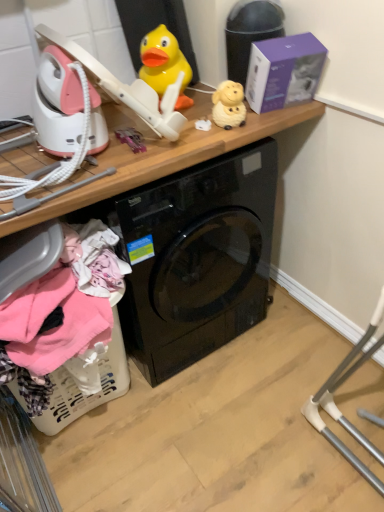
Question: From a real-world perspective, is wooden at upper center physically below white plastic laundry basket at lower left?

Choices:
 (A) no
 (B) yes

Answer: (A)

Question: Considering the relative sizes of wooden at upper center and white plastic laundry basket at lower left in the image provided, is wooden at upper center shorter than white plastic laundry basket at lower left?

Choices:
 (A) yes
 (B) no

Answer: (B)

Question: Is white plastic laundry basket at lower left completely or partially inside wooden at upper center?

Choices:
 (A) no
 (B) yes

Answer: (B)

Question: From the image's perspective, is wooden at upper center over white plastic laundry basket at lower left?

Choices:
 (A) yes
 (B) no

Answer: (A)

Question: Is wooden at upper center at the right side of white plastic laundry basket at lower left?

Choices:
 (A) no
 (B) yes

Answer: (B)

Question: Does wooden at upper center have a smaller size compared to white plastic laundry basket at lower left?

Choices:
 (A) no
 (B) yes

Answer: (A)

Question: Is white plastic laundry basket at lower left closer to camera compared to matte yellow sheep at upper center, placed as the 2th toy when sorted from left to right?

Choices:
 (A) no
 (B) yes

Answer: (B)

Question: Does white plastic laundry basket at lower left contain matte yellow sheep at upper center, placed as the 2th toy when sorted from left to right?

Choices:
 (A) yes
 (B) no

Answer: (B)

Question: Is white plastic laundry basket at lower left to the left of matte yellow sheep at upper center, positioned as the first toy in right-to-left order, from the viewer's perspective?

Choices:
 (A) no
 (B) yes

Answer: (B)

Question: Is white plastic laundry basket at lower left aimed at matte yellow sheep at upper center, positioned as the first toy in right-to-left order?

Choices:
 (A) no
 (B) yes

Answer: (A)

Question: Considering the relative sizes of white plastic laundry basket at lower left and matte yellow sheep at upper center, placed as the 2th toy when sorted from left to right, in the image provided, is white plastic laundry basket at lower left smaller than matte yellow sheep at upper center, placed as the 2th toy when sorted from left to right,?

Choices:
 (A) no
 (B) yes

Answer: (A)

Question: Can you confirm if white plastic laundry basket at lower left is thinner than matte yellow sheep at upper center, positioned as the first toy in right-to-left order?

Choices:
 (A) no
 (B) yes

Answer: (A)

Question: From a real-world perspective, is purple matte box at upper right positioned over wooden at upper center based on gravity?

Choices:
 (A) no
 (B) yes

Answer: (B)